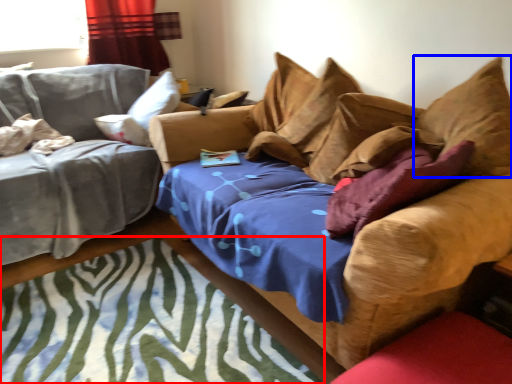
Question: Which of the following is the farthest to the observer, mat (highlighted by a red box) or pillow (highlighted by a blue box)?

Choices:
 (A) mat
 (B) pillow

Answer: (B)